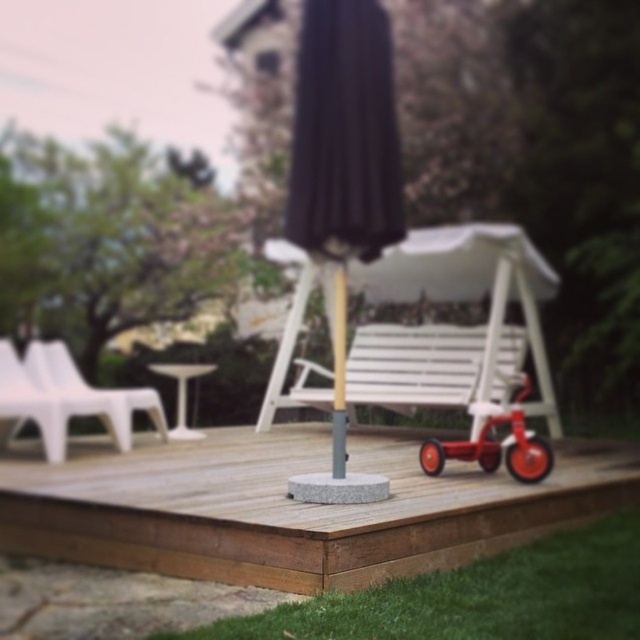
You are planning to place a new potted plant between the white plastic chair at left and the wooden pole at center. Based on their positions, which object should the plant be closer to?

The white plastic chair at left is positioned to the left of the wooden pole at center, so the plant should be placed closer to the wooden pole at center to maintain symmetry between the two objects.

You are a painter standing on the wooden deck and want to hang a large canvas between the black fabric umbrella at center and the white plastic stool at lower center. Since the canvas needs to be hung at a height that accommodates both objects, which object should the canvas be positioned closer to to ensure it doesn

The canvas should be positioned closer to the white plastic stool at lower center because the black fabric umbrella at center is taller than the white plastic stool at lower center, so placing it closer to the shorter object will allow the canvas to be at a suitable height for both.

You are planning to set up a small garden between the white plastic chair at left and the wooden pole at center. Considering their heights, which object will block more sunlight for the plants?

The wooden pole at center is taller than the white plastic chair at left, so it will block more sunlight for the plants.